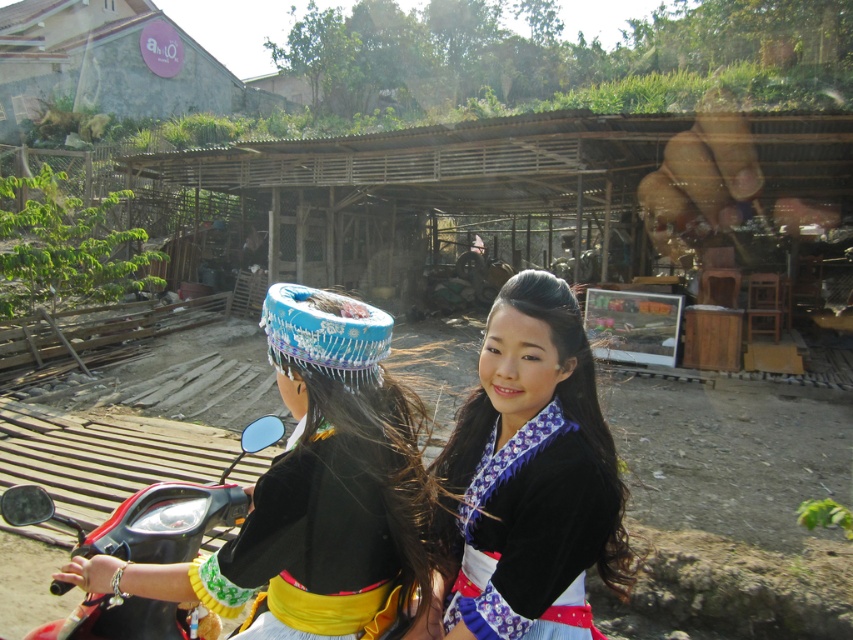
Question: Which of the following is the farthest from the observer?

Choices:
 (A) blue fabric headdress at center
 (B) matte black kimono at center
 (C) matte black helmet at center
 (D) shiny black motorcycle at center

Answer: (D)

Question: Which of the following is the farthest from the observer?

Choices:
 (A) (293, 305)
 (B) (514, 493)
 (C) (12, 522)

Answer: (C)

Question: Does matte black kimono at center come in front of blue fabric headdress at center?

Choices:
 (A) no
 (B) yes

Answer: (B)

Question: Does matte black helmet at center appear on the right side of matte black kimono at center?

Choices:
 (A) yes
 (B) no

Answer: (B)

Question: Based on their relative distances, which object is farther from the matte black helmet at center?

Choices:
 (A) shiny black motorcycle at center
 (B) blue fabric headdress at center

Answer: (A)

Question: Can you confirm if matte black helmet at center is positioned below blue fabric headdress at center?

Choices:
 (A) yes
 (B) no

Answer: (A)